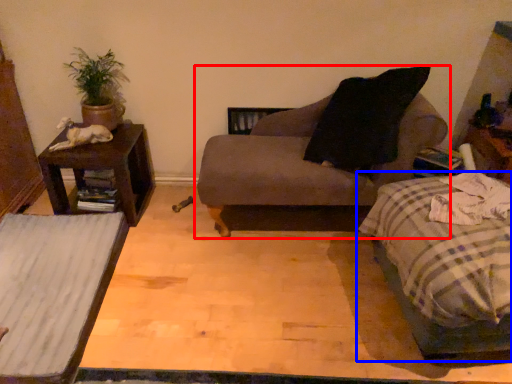
Question: Which object is further to the camera taking this photo, chair (highlighted by a red box) or bed (highlighted by a blue box)?

Choices:
 (A) chair
 (B) bed

Answer: (A)